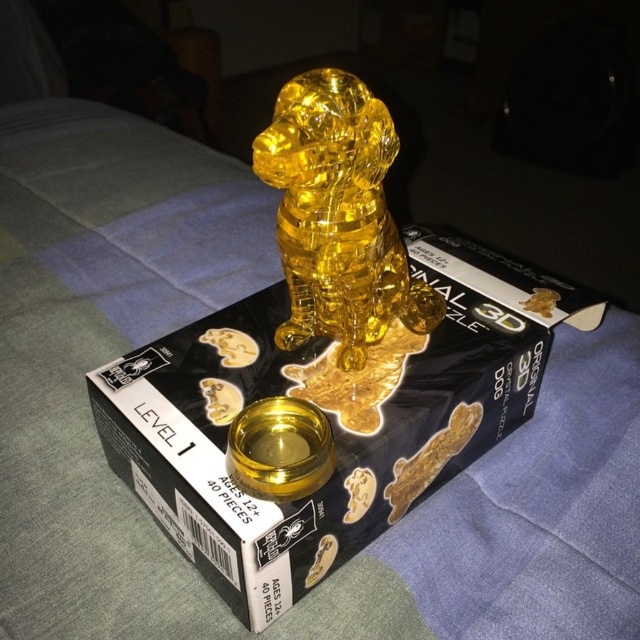
Question: Which point is farther to the camera?

Choices:
 (A) (278, 493)
 (B) (164, 364)
 (C) (273, 156)

Answer: (B)

Question: Among these points, which one is nearest to the camera?

Choices:
 (A) (348, 296)
 (B) (234, 468)

Answer: (B)

Question: Which object is the closest to the translucent yellow crystal dog at center?

Choices:
 (A) translucent yellow plastic at center
 (B) gold shiny bowl at center

Answer: (A)

Question: Can you confirm if translucent yellow plastic at center is bigger than gold shiny bowl at center?

Choices:
 (A) yes
 (B) no

Answer: (A)

Question: Considering the relative positions of translucent yellow crystal dog at center and gold shiny bowl at center in the image provided, where is translucent yellow crystal dog at center located with respect to gold shiny bowl at center?

Choices:
 (A) above
 (B) below

Answer: (A)

Question: Where is translucent yellow plastic at center located in relation to translucent yellow crystal dog at center in the image?

Choices:
 (A) right
 (B) left

Answer: (A)